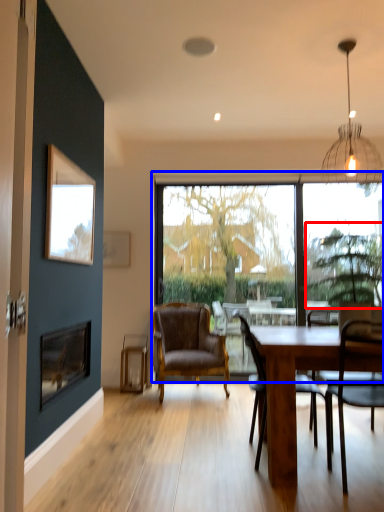
Question: Which object appears farthest to the camera in this image, tree (highlighted by a red box) or window (highlighted by a blue box)?

Choices:
 (A) tree
 (B) window

Answer: (B)